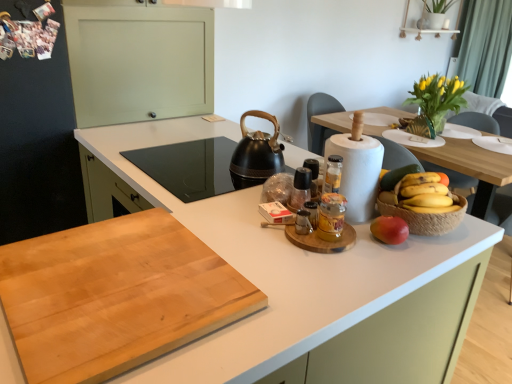
Find the location of a particular element. Image resolution: width=512 pixels, height=384 pixels. free point to the left of red matte apple at right is located at coordinates (350, 250).